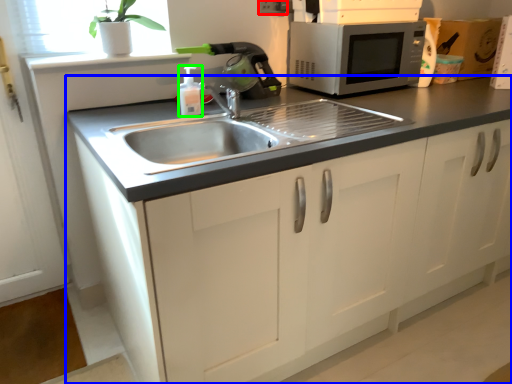
Question: Which object is the farthest from electric outlet (highlighted by a red box)? Choose among these: cabinetry (highlighted by a blue box) or bottle (highlighted by a green box).

Choices:
 (A) cabinetry
 (B) bottle

Answer: (A)